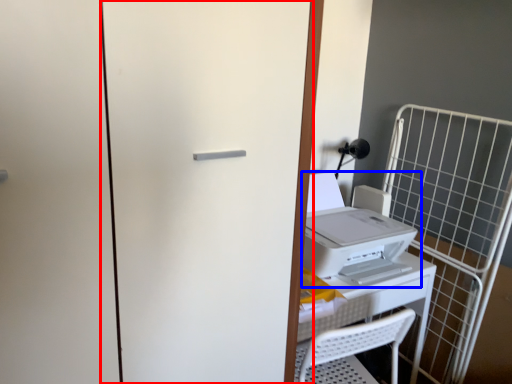
Question: Which point is closer to the camera, screen door (highlighted by a red box) or home appliance (highlighted by a blue box)?

Choices:
 (A) screen door
 (B) home appliance

Answer: (A)